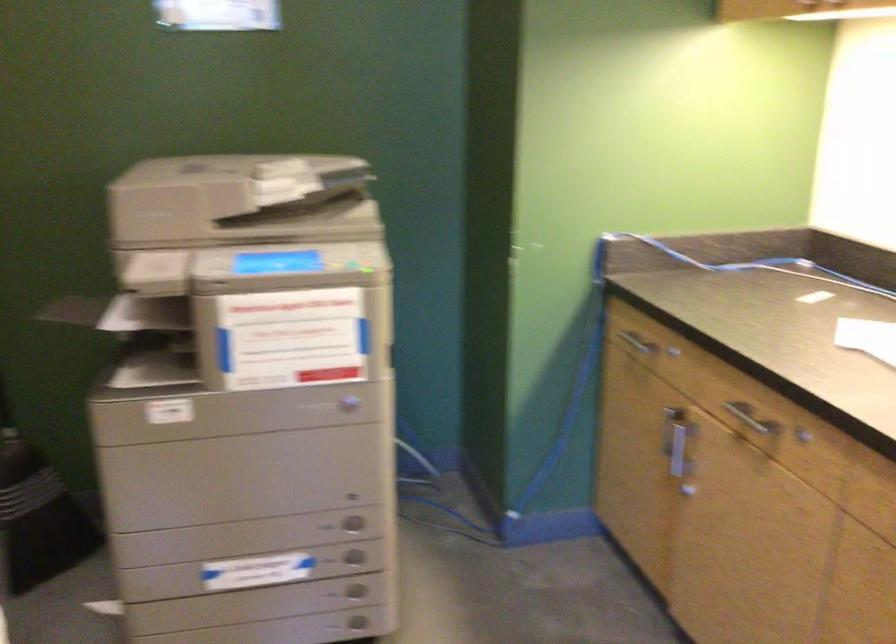
The images are taken continuously from a first-person perspective. In which direction is your viewpoint rotating?

The rotation direction of the camera is left-down.